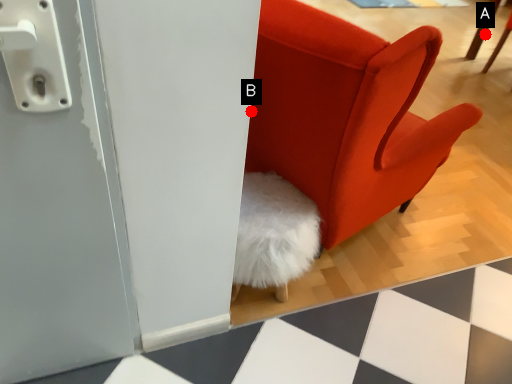
Question: Two points are circled on the image, labeled by A and B beside each circle. Which point is closer to the camera?

Choices:
 (A) A is closer
 (B) B is closer

Answer: (B)